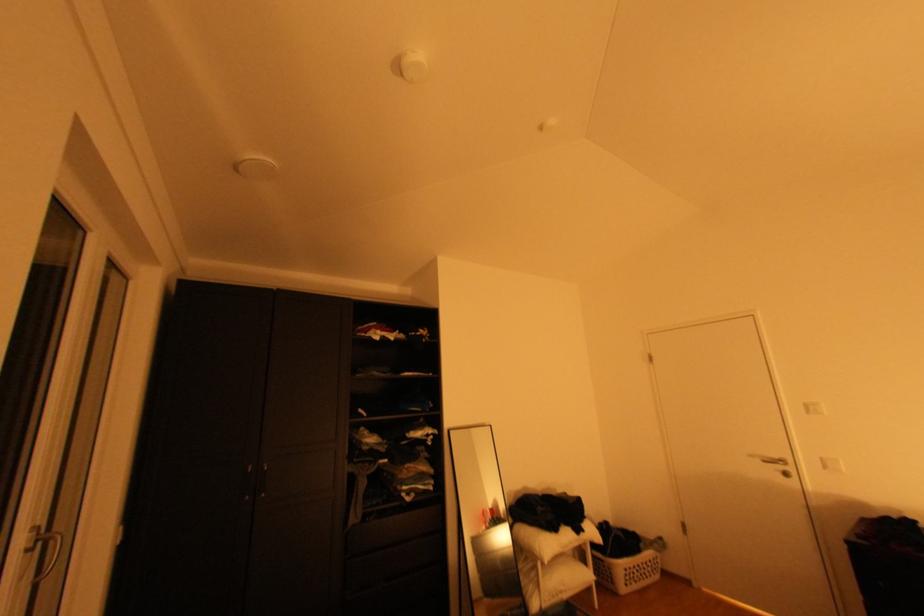
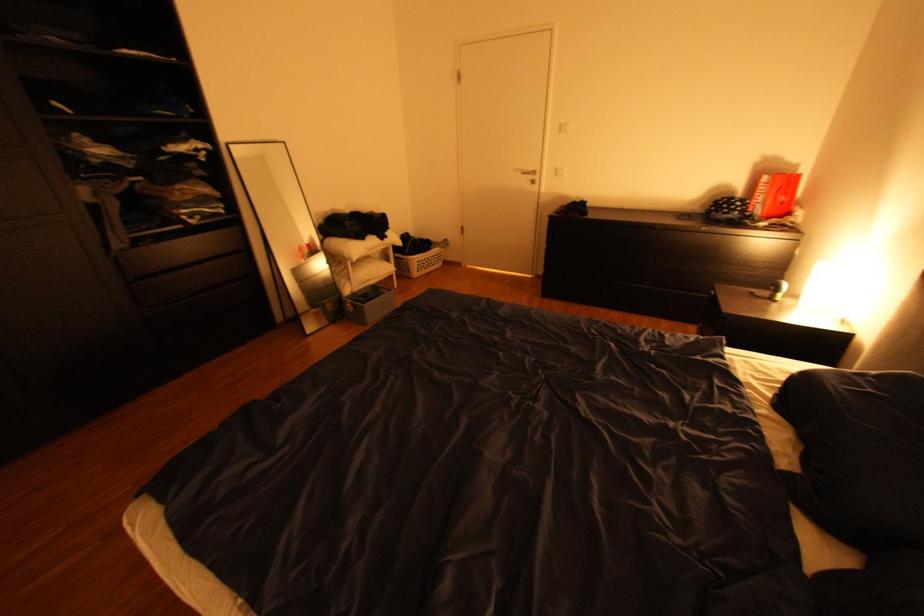
The images are taken continuously from a first-person perspective. In which direction is your viewpoint rotating?

The rotation direction of the camera is right-down.